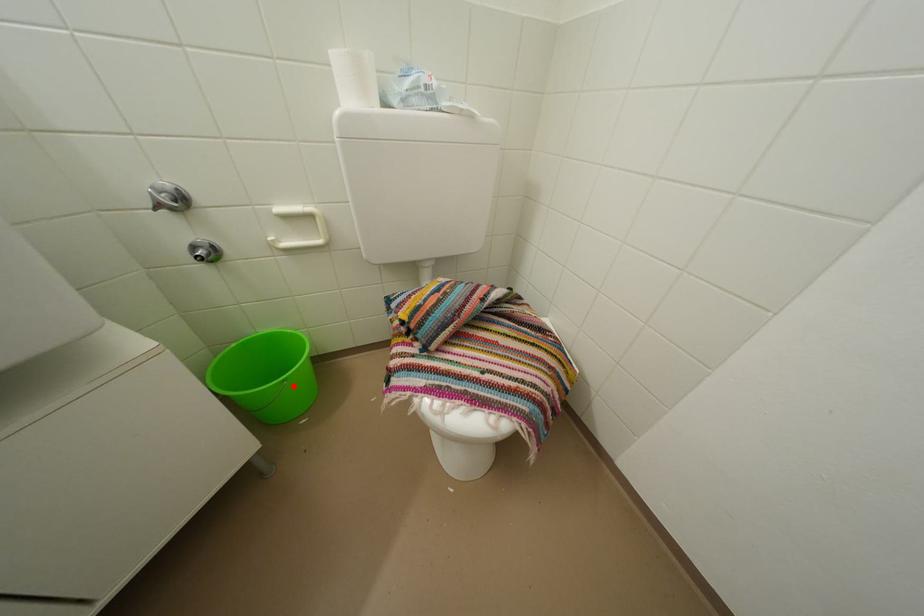
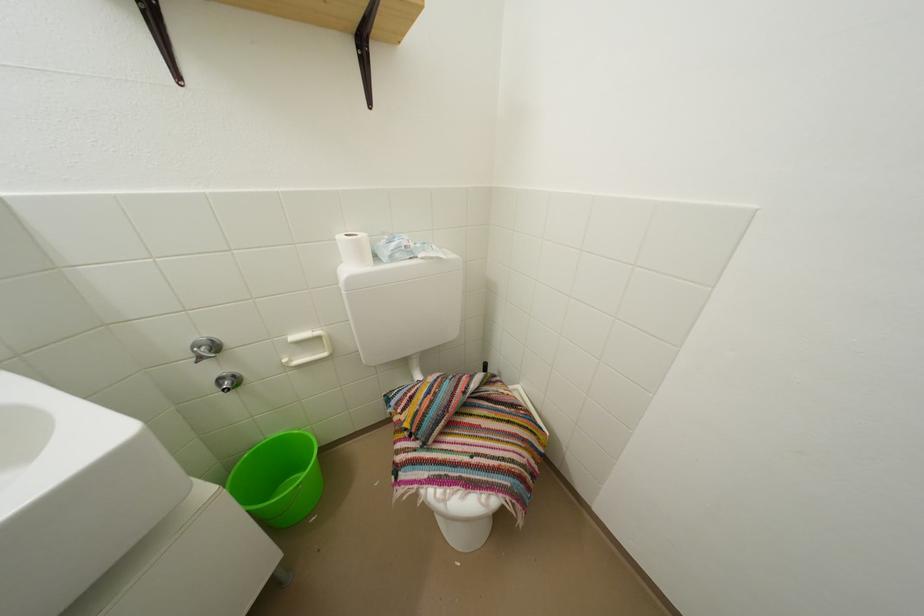
Question: I am providing you with two images of the same scene from different viewpoints. A red point is shown in image1. For the corresponding object point in image2, is it positioned nearer or farther from the camera?

Choices:
 (A) Nearer
 (B) Farther

Answer: (B)